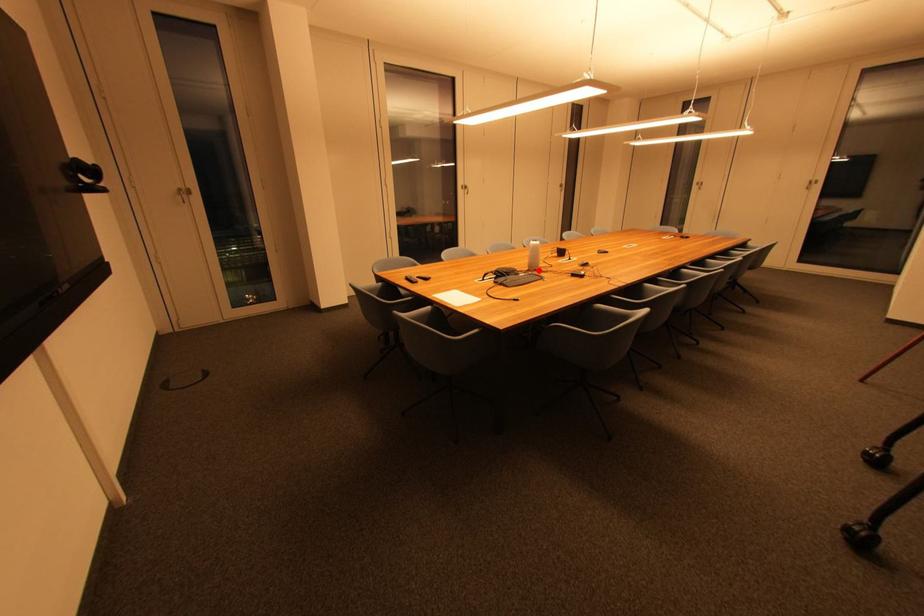
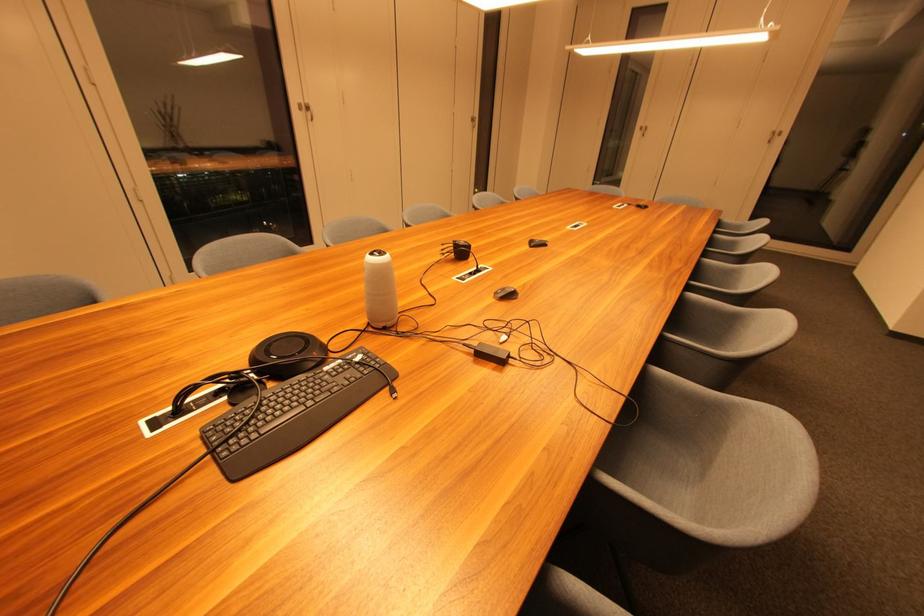
Where in the second image is the point corresponding to the highlighted location from the first image?

(386, 326)